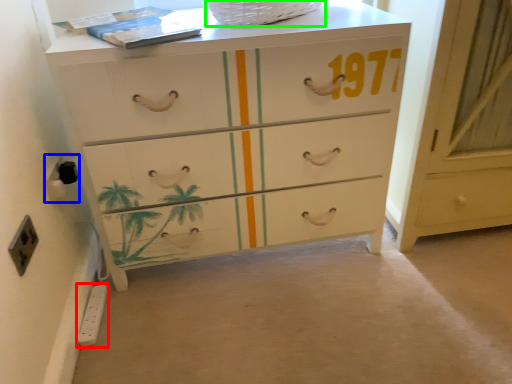
Question: Estimate the real-world distances between objects in this image. Which object is closer to electric outlet (highlighted by a red box), electric outlet (highlighted by a blue box) or basket (highlighted by a green box)?

Choices:
 (A) electric outlet
 (B) basket

Answer: (A)